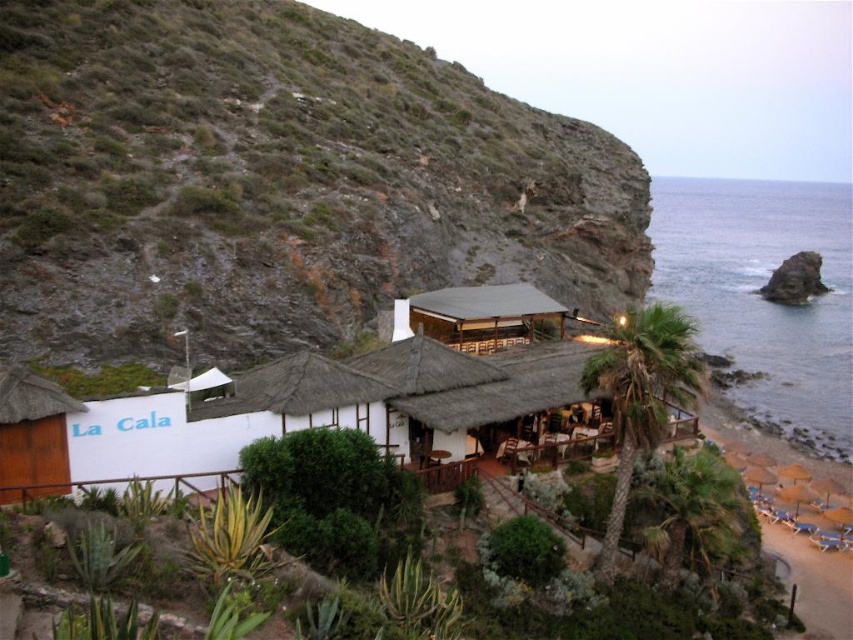
You are standing at the base of the cliff and want to reach the wooden thatched hut at center. Which direction should you move to avoid the rocky cliff at upper left blocking your view?

You should move to the right of the rocky cliff at upper left to avoid it blocking your view, as the rocky cliff at upper left is in front of the wooden thatched hut at center.

You are standing at the point marked as point (x=276, y=180) in the coastal scene. Looking around, you notice the rustic building named La Cala with its thatched roof and white walls. Which direction should you head to reach the building from your current position?

The point (x=276, y=180) is located on the rocky cliff at upper left. Since La Cala is situated against the cliffside, you should head downward towards the building from your current position on the upper left cliff.

You are standing in front of the rustic building called La Cala. You notice the rocky cliff at upper left and the white thatched roof at center. Which of these two objects is closer to you?

The rocky cliff at upper left is closer to you because it is further to the viewer than the white thatched roof at center, meaning it appears nearer in the perspective.